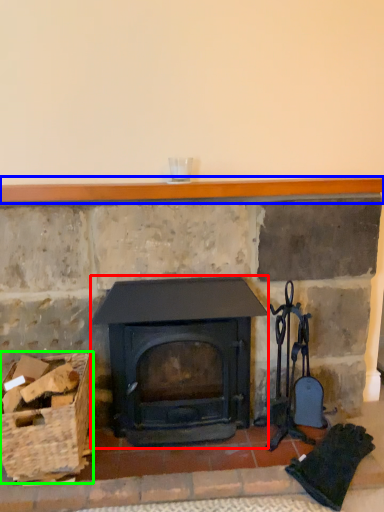
Question: Based on their relative distances, which object is nearer to wood burning stove (highlighted by a red box)? Choose from balustrade (highlighted by a blue box) and basket (highlighted by a green box).

Choices:
 (A) balustrade
 (B) basket

Answer: (B)